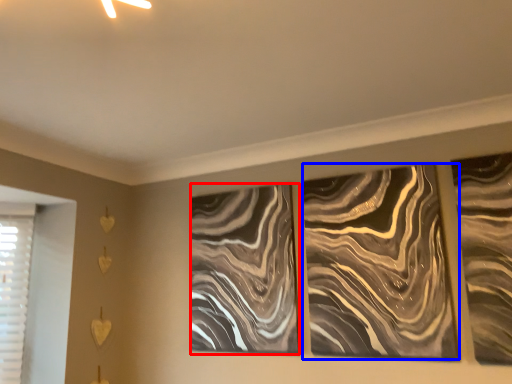
Question: Which object appears closest to the camera in this image, design (highlighted by a red box) or design (highlighted by a blue box)?

Choices:
 (A) design
 (B) design

Answer: (B)